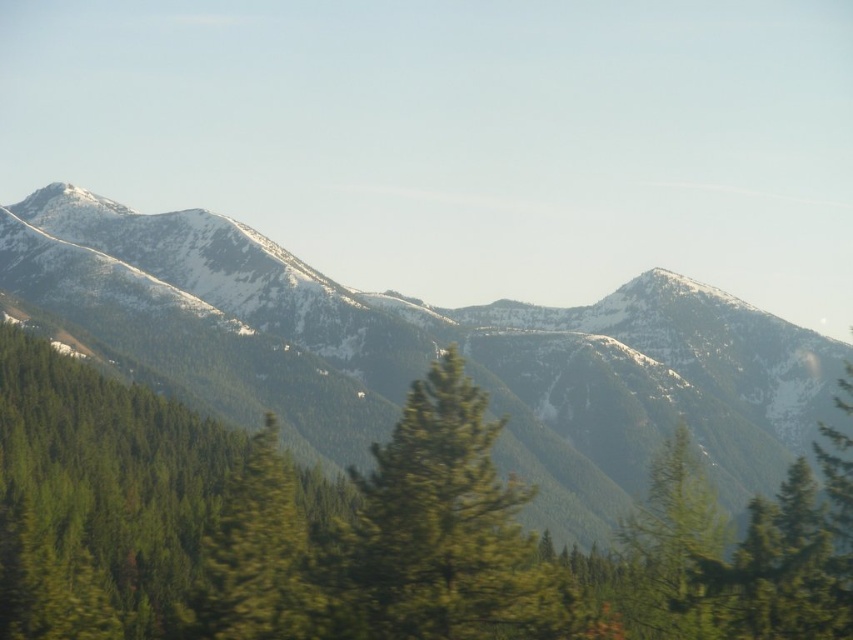
Question: Among these points, which one is nearest to the camera?

Choices:
 (A) (492, 518)
 (B) (347, 422)
 (C) (271, 419)

Answer: (A)

Question: Estimate the real-world distances between objects in this image. Which object is closer to the green textured tree at center?

Choices:
 (A) snowy rocky mountain range at center
 (B) green matte tree at center

Answer: (B)

Question: Is snowy rocky mountain range at center smaller than green matte tree at center?

Choices:
 (A) yes
 (B) no

Answer: (B)

Question: Does snowy rocky mountain range at center appear on the left side of green textured tree at center?

Choices:
 (A) no
 (B) yes

Answer: (A)

Question: Can you confirm if snowy rocky mountain range at center is wider than green textured tree at center?

Choices:
 (A) no
 (B) yes

Answer: (B)

Question: Which of these objects is positioned farthest from the green matte tree at center?

Choices:
 (A) green textured tree at center
 (B) snowy rocky mountain range at center

Answer: (B)